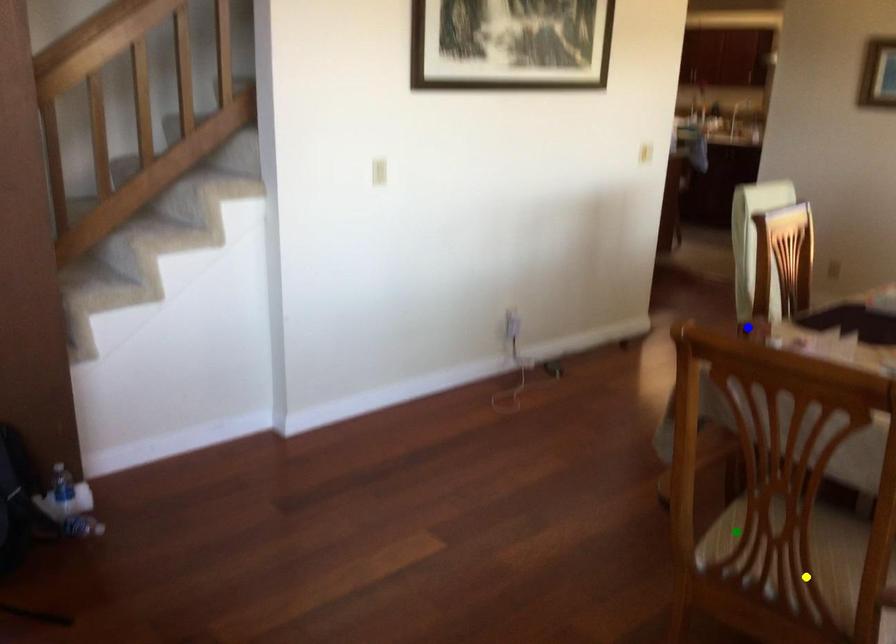
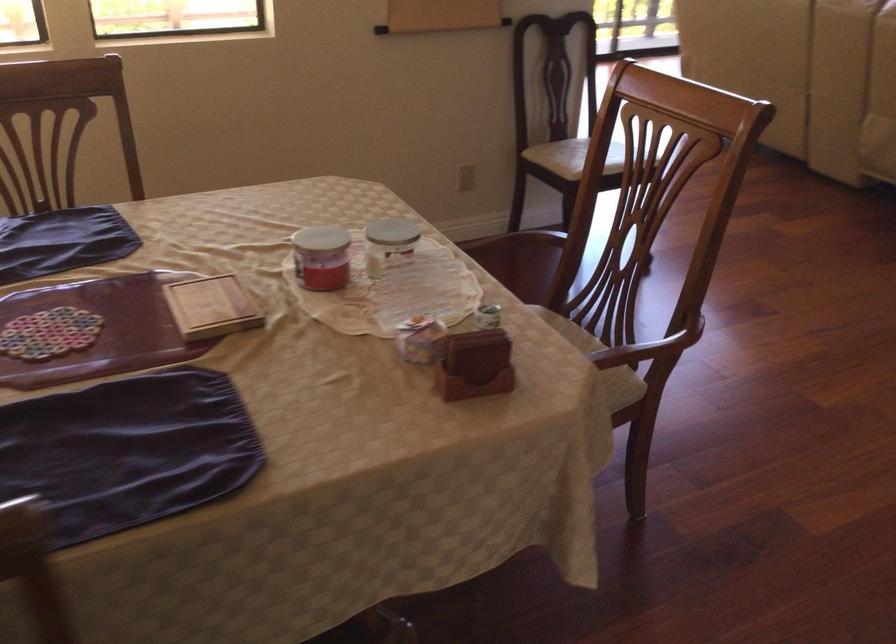
I am providing you with two images of the same scene from different viewpoints. Three points are marked in image1. Which point corresponds to a part or object that is occluded in image2?In image1, three points are marked. Which of them correspond to a part or object that is occluded in image2?Among the three points shown in image1, which one corresponds to a part or object that is no longer visible due to occlusion in image2?

Invisible in image2: green point.